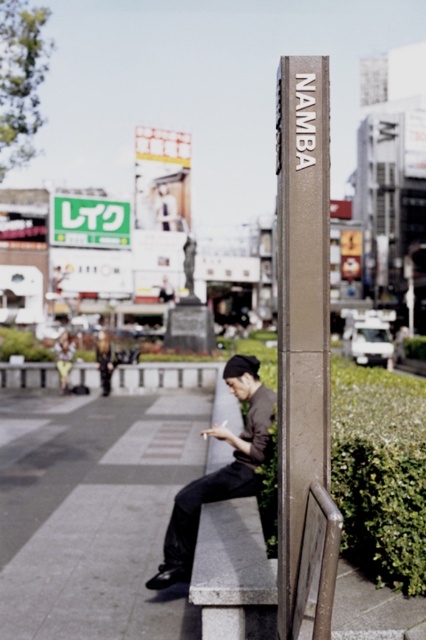
You are a photographer trying to capture a photo of the dark gray fabric jacket at center and the green plastic sign at upper center. Which object should you focus on if you want the one that is shorter to be in sharp focus?

The dark gray fabric jacket at center is not as tall as the green plastic sign at upper center, so you should focus on the dark gray fabric jacket at center since it is shorter.

You are a tourist in Namba, Japan, and you see the bronze metallic signpost at center and the green plastic sign at upper center. Which sign is closer to you?

The bronze metallic signpost at center is closer to you because it is in front of the green plastic sign at upper center.

You are a tourist in Namba, Japan, and you see the bronze metallic signpost at center and the green plastic sign at upper center. Which sign is located higher up?

The green plastic sign at upper center is higher up because the bronze metallic signpost at center is positioned under it.